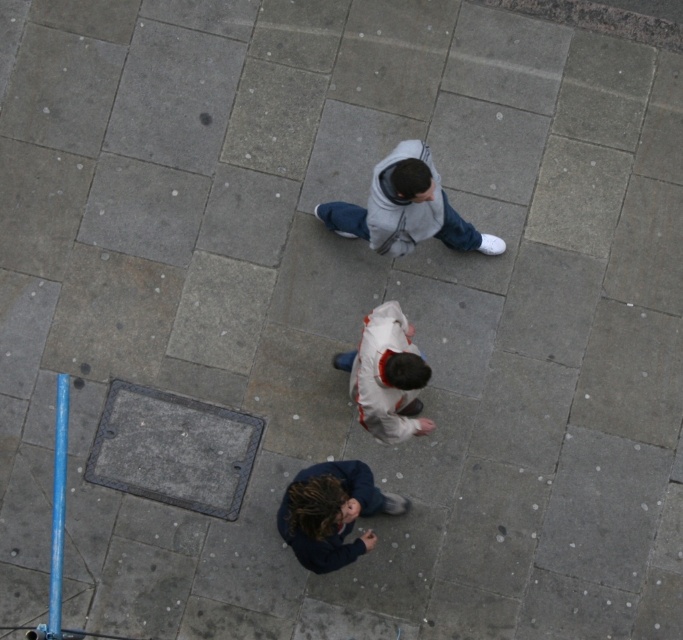
Question: Does gray fleece jacket at upper center appear over white matte jacket at center?

Choices:
 (A) no
 (B) yes

Answer: (B)

Question: Among these points, which one is nearest to the camera?

Choices:
 (A) tap(372, 404)
 (B) tap(370, 497)
 (C) tap(390, 168)

Answer: (C)

Question: Which point is farther from the camera taking this photo?

Choices:
 (A) (402, 198)
 (B) (406, 413)
 (C) (318, 570)

Answer: (B)

Question: Which of the following is the closest to the observer?

Choices:
 (A) (359, 216)
 (B) (390, 420)
 (C) (292, 508)

Answer: (C)

Question: Does dark blue fleece jacket at lower center appear under white matte jacket at center?

Choices:
 (A) no
 (B) yes

Answer: (B)

Question: Is gray fleece jacket at upper center bigger than dark blue fleece jacket at lower center?

Choices:
 (A) yes
 (B) no

Answer: (A)